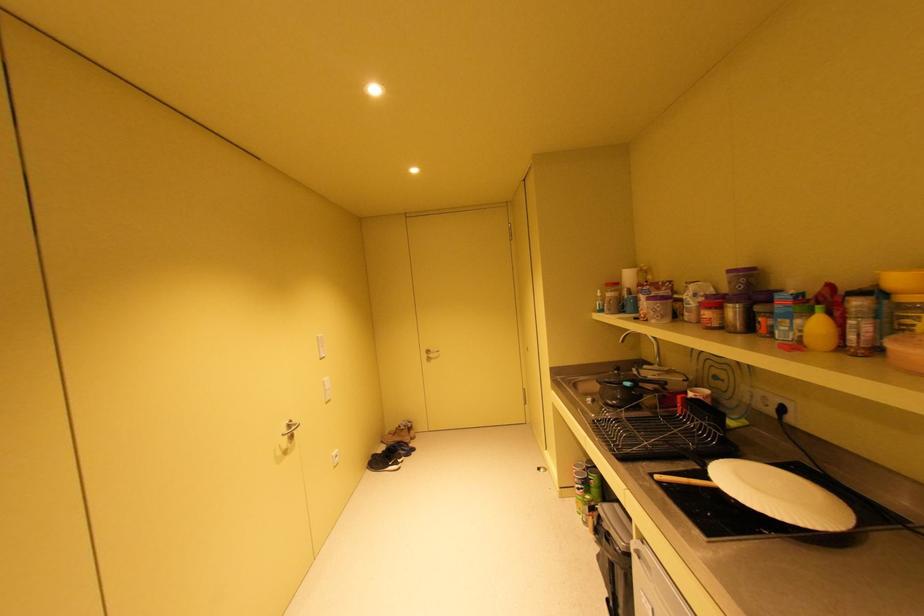
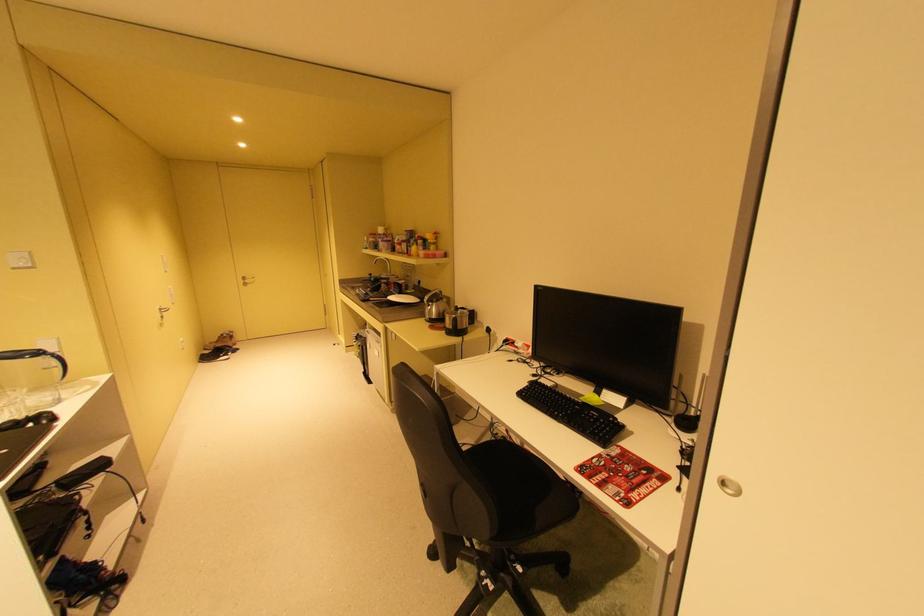
Where in the second image is the point corresponding to pixel 837 286 from the first image?

(428, 237)